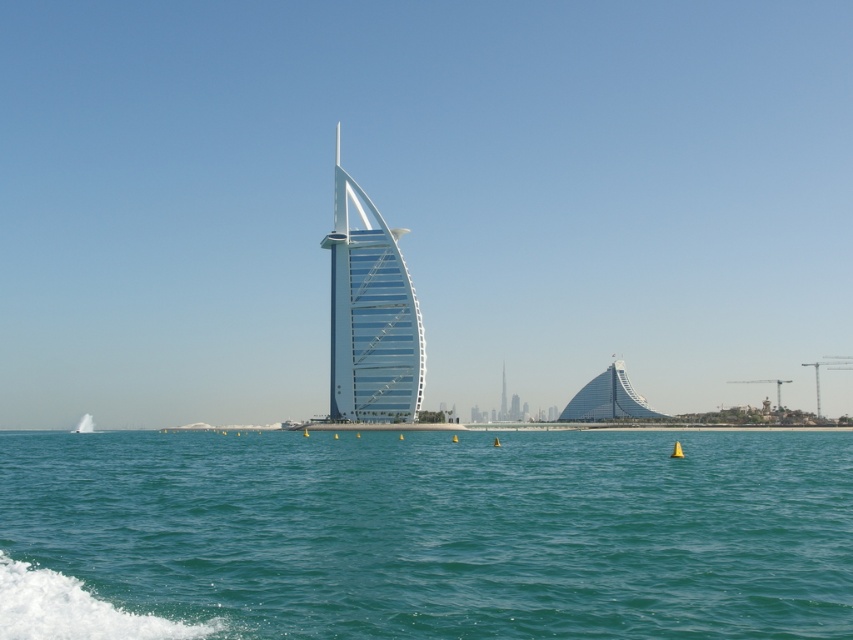
Between clear blue water at center and transparent glass sail at center, which one is positioned higher?

transparent glass sail at center

Who is positioned more to the left, clear blue water at center or transparent glass sail at center?

transparent glass sail at center

I want to click on clear blue water at center, so click(427, 534).